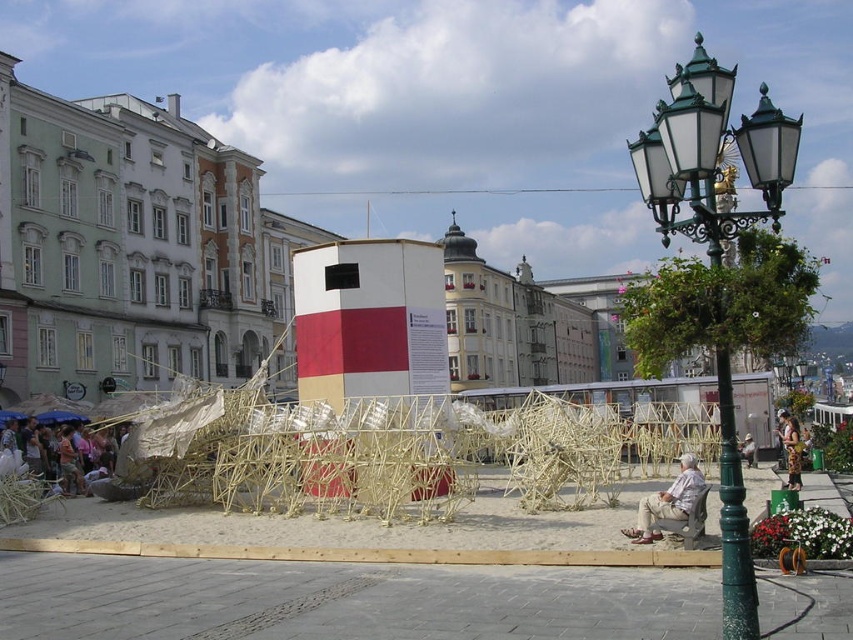
Between beige fabric chair at lower right and light brown wooden bench at center, which one appears on the left side from the viewer's perspective?

Positioned to the left is beige fabric chair at lower right.

Who is lower down, beige fabric chair at lower right or light brown wooden bench at center?

beige fabric chair at lower right is lower down.

Measure the distance between point (656, 499) and camera.

43.78 meters

Find the location of a particular element. This screenshot has width=853, height=640. beige fabric chair at lower right is located at coordinates pyautogui.click(x=668, y=500).

Looking at this image, is light brown fabric at lower left wider than beige fabric chair at lower right?

Correct, the width of light brown fabric at lower left exceeds that of beige fabric chair at lower right.

This screenshot has height=640, width=853. What do you see at coordinates (91, 470) in the screenshot?
I see `light brown fabric at lower left` at bounding box center [91, 470].

Which is behind, point (128, 458) or point (657, 536)?

Positioned behind is point (128, 458).

Locate an element on the screen. Image resolution: width=853 pixels, height=640 pixels. light brown fabric at lower left is located at coordinates (91, 470).

Between green metal streetlight at right and light brown fabric at lower left, which one appears on the left side from the viewer's perspective?

Positioned to the left is light brown fabric at lower left.

Between point (749, 120) and point (135, 488), which one is positioned behind?

The point (135, 488) is behind.

Where is `green metal streetlight at right`? The width and height of the screenshot is (853, 640). green metal streetlight at right is located at coordinates (711, 156).